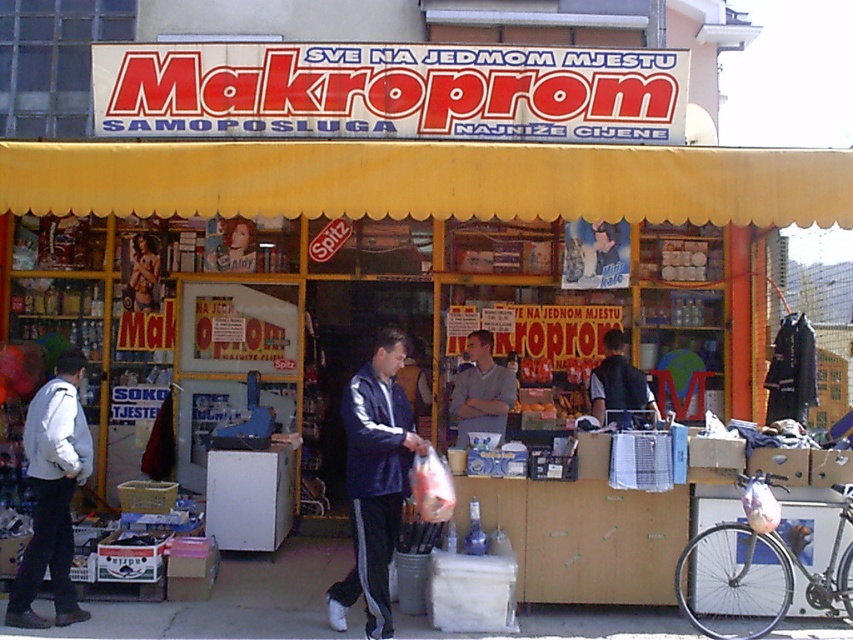
Question: Does yellow fabric canopy at upper center appear over dark blue leather jacket at center?

Choices:
 (A) no
 (B) yes

Answer: (B)

Question: Observing the image, what is the correct spatial positioning of light gray jacket at left in reference to light gray sweater at center?

Choices:
 (A) left
 (B) right

Answer: (A)

Question: Which object is positioned closest to the light gray sweater at center?

Choices:
 (A) dark blue leather jacket at center
 (B) yellow fabric canopy at upper center
 (C) dark blue track suit at center

Answer: (A)

Question: Where is yellow fabric canopy at upper center located in relation to dark blue leather jacket at center in the image?

Choices:
 (A) above
 (B) below

Answer: (A)

Question: Estimate the real-world distances between objects in this image. Which object is farther from the yellow fabric canopy at upper center?

Choices:
 (A) light gray jacket at left
 (B) light gray sweater at center

Answer: (B)

Question: Which object is farther from the camera taking this photo?

Choices:
 (A) light gray jacket at left
 (B) light gray sweater at center
 (C) dark blue leather jacket at center

Answer: (B)